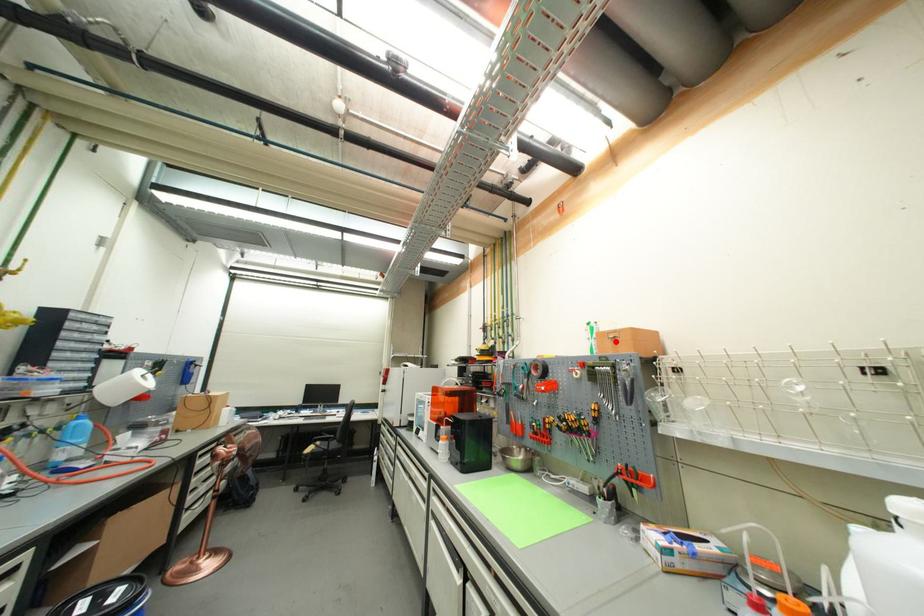
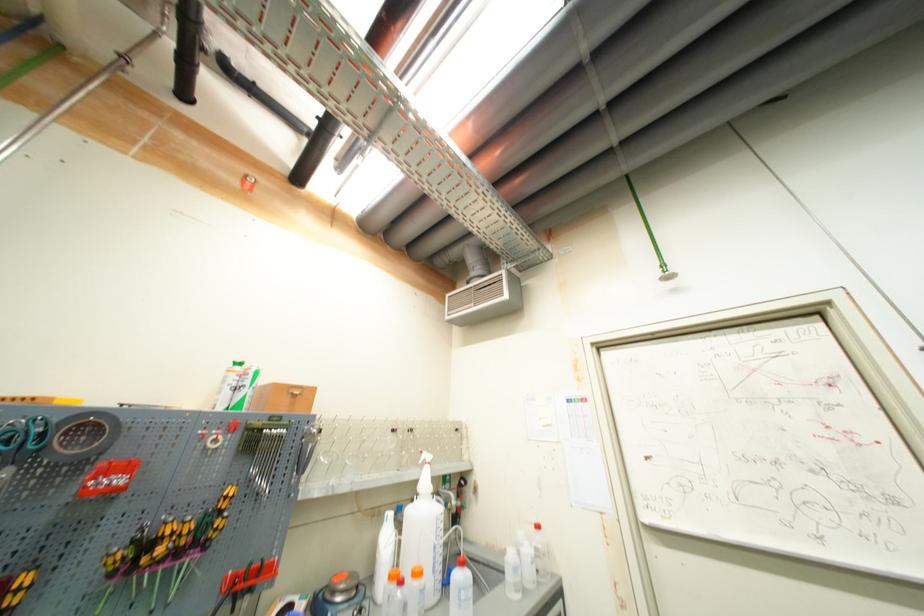
Find the pixel in the second image that matches the highlighted location in the first image.

(295, 398)